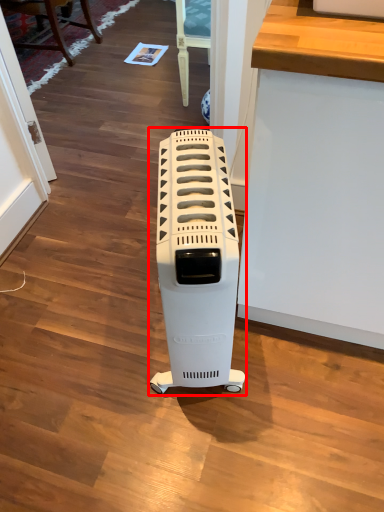
Question: From the image's perspective, what is the correct spatial positioning of home appliance (annotated by the red box) in reference to furniture?

Choices:
 (A) above
 (B) below

Answer: (B)